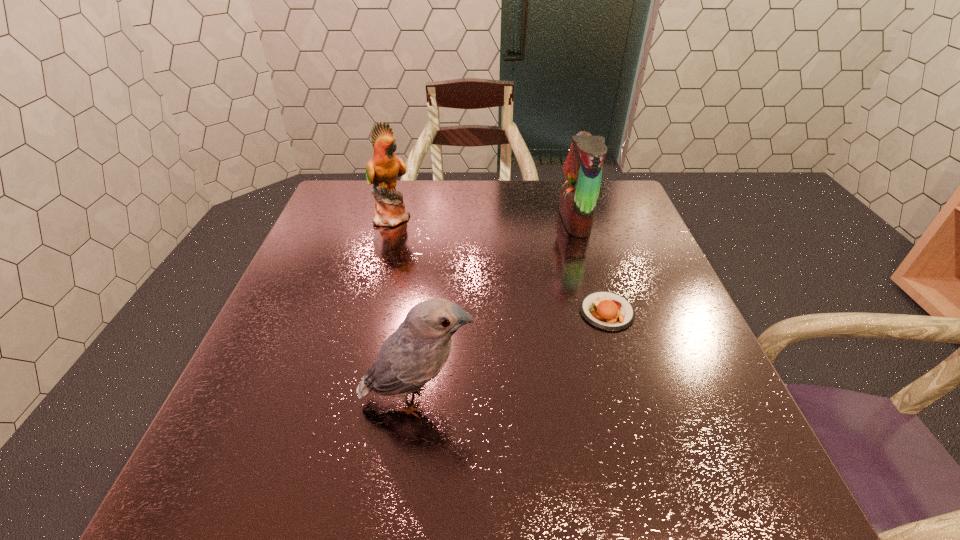
You are a GUI agent. You are given a task and a screenshot of the screen. Output one action in this format:
    pyautogui.click(x=<x>, y=<y>)
    Task: Click on the parrot that is positioned at the right edge
    The height and width of the screenshot is (540, 960).
    Given the screenshot: What is the action you would take?
    pyautogui.click(x=583, y=168)

You are a GUI agent. You are given a task and a screenshot of the screen. Output one action in this format:
    pyautogui.click(x=<x>, y=<y>)
    Task: Click on the patty (food) that is positioned at the right edge
    The image size is (960, 540).
    Given the screenshot: What is the action you would take?
    pyautogui.click(x=605, y=310)

Where is `object that is positioned at the far left corner`? The width and height of the screenshot is (960, 540). object that is positioned at the far left corner is located at coordinates (382, 170).

Locate an element on the screen. The height and width of the screenshot is (540, 960). object at the far right corner is located at coordinates (583, 168).

In the image, there is a desktop. Where is `free space at the far edge`? Image resolution: width=960 pixels, height=540 pixels. free space at the far edge is located at coordinates (507, 208).

You are a GUI agent. You are given a task and a screenshot of the screen. Output one action in this format:
    pyautogui.click(x=<x>, y=<y>)
    Task: Click on the free spot at the near edge of the desktop
    
    Given the screenshot: What is the action you would take?
    pyautogui.click(x=309, y=459)

You are a GUI agent. You are given a task and a screenshot of the screen. Output one action in this format:
    pyautogui.click(x=<x>, y=<y>)
    Task: Click on the vacant region at the left edge of the desktop
    Image resolution: width=960 pixels, height=540 pixels.
    Given the screenshot: What is the action you would take?
    pyautogui.click(x=341, y=301)

The width and height of the screenshot is (960, 540). Find the location of `free region at the right edge of the desktop`. free region at the right edge of the desktop is located at coordinates (642, 381).

Where is `vacant space at the far left corner`? The image size is (960, 540). vacant space at the far left corner is located at coordinates (343, 187).

Identify the location of blank space at the near left corner. (187, 505).